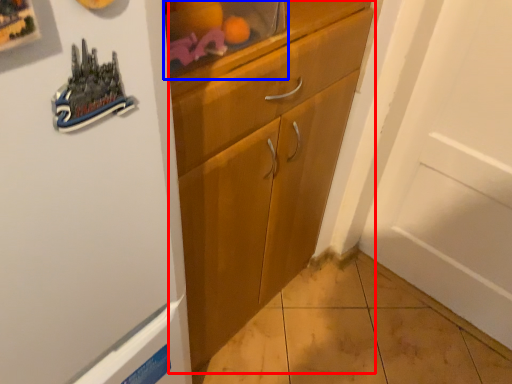
Question: Which point is closer to the camera, cabinetry (highlighted by a red box) or shelf (highlighted by a blue box)?

Choices:
 (A) cabinetry
 (B) shelf

Answer: (B)